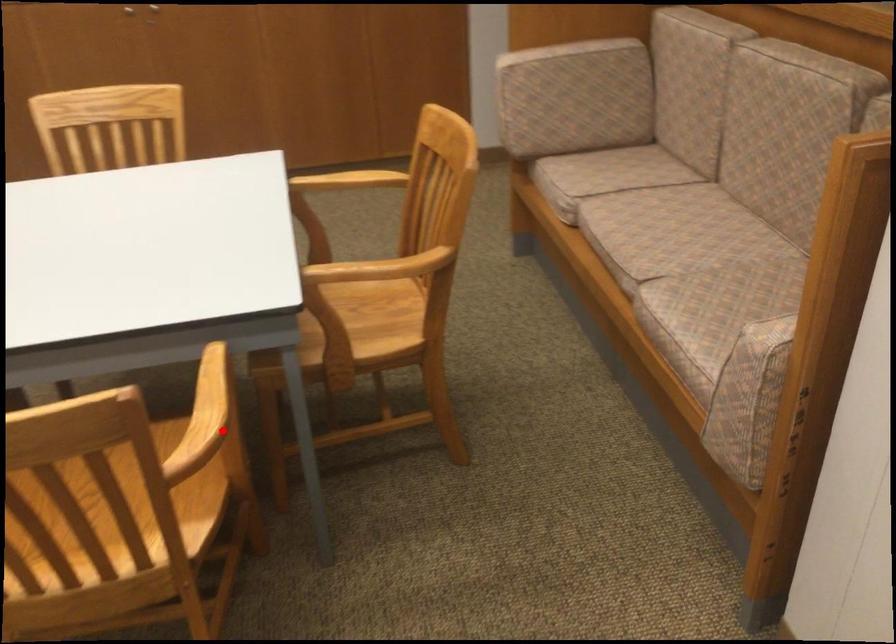
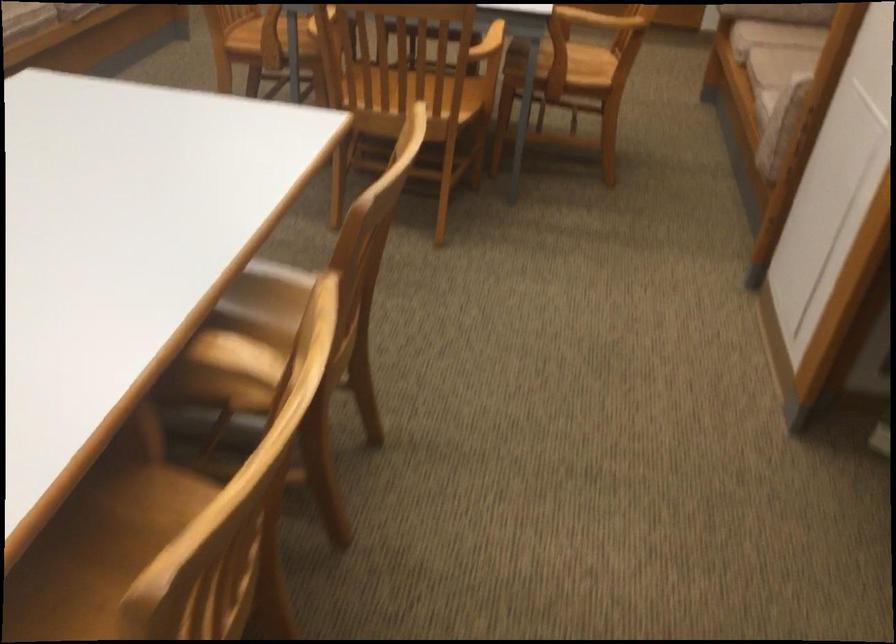
Question: I am providing you with two images of the same scene from different viewpoints. Image1 has a red point marked. In image2, the corresponding 3D location appears at what relative position? Reply with the corresponding letter.

Choices:
 (A) Closer
 (B) Farther

Answer: (B)